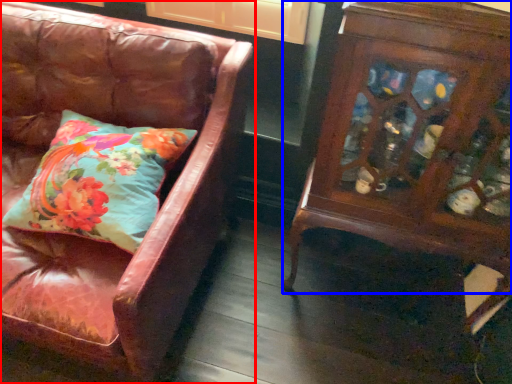
Question: Which point is closer to the camera, chair (highlighted by a red box) or furniture (highlighted by a blue box)?

Choices:
 (A) chair
 (B) furniture

Answer: (A)